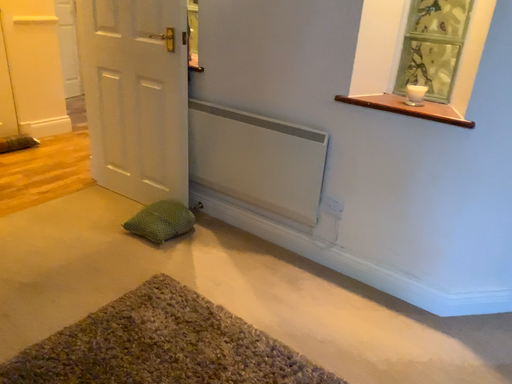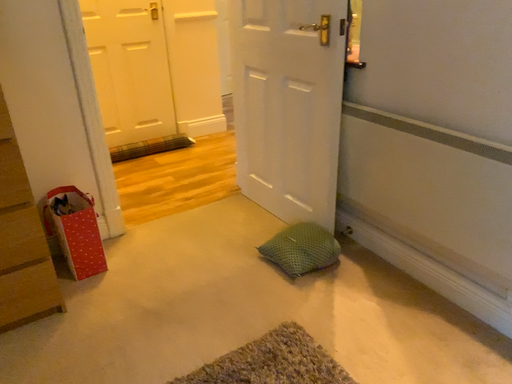
Question: Which way did the camera rotate in the video?

Choices:
 (A) rotated left
 (B) rotated right

Answer: (A)